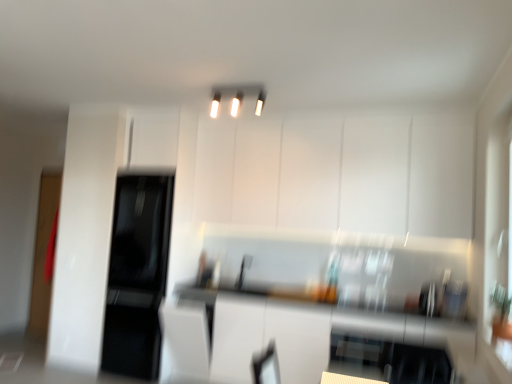
Question: Choose the correct answer: Is white glossy countertop at center inside white glossy cabinet at upper center or outside it?

Choices:
 (A) inside
 (B) outside

Answer: (B)

Question: Looking at the image, does white glossy countertop at center seem bigger or smaller compared to white glossy cabinet at upper center?

Choices:
 (A) big
 (B) small

Answer: (A)

Question: Which object is positioned closest to the black glossy refrigerator at left?

Choices:
 (A) white glossy light fixture at upper center
 (B) white glossy cabinet at upper center
 (C) white glossy countertop at center

Answer: (C)

Question: Which is nearer to the white glossy countertop at center?

Choices:
 (A) black glossy refrigerator at left
 (B) white glossy light fixture at upper center
 (C) white glossy cabinet at upper center

Answer: (C)